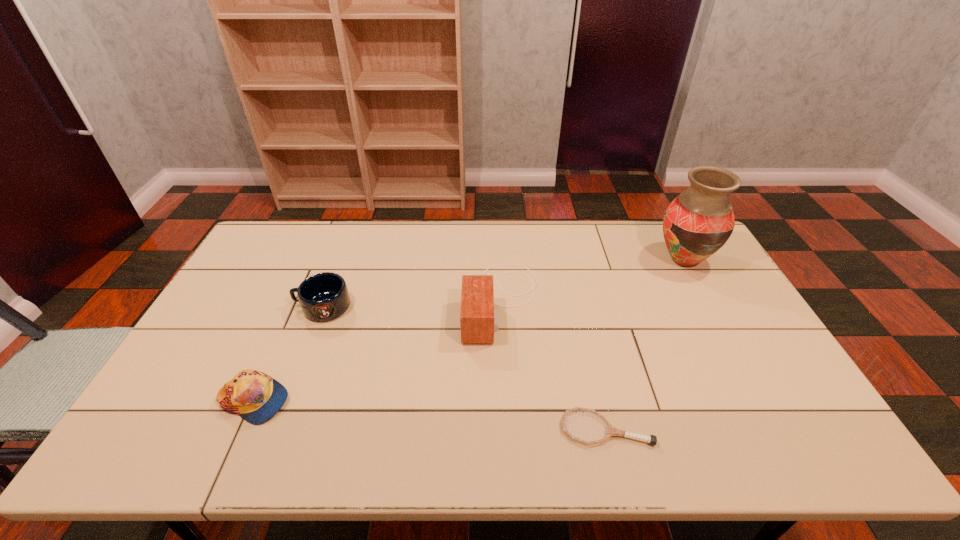
Identify the location of unoccupied area between the third object from right to left and the cap. The height and width of the screenshot is (540, 960). (377, 351).

Image resolution: width=960 pixels, height=540 pixels. What are the coordinates of `empty space that is in between the tallest object and the second tallest object` in the screenshot? It's located at [x=592, y=281].

Where is `free spot between the cap and the mug`? Image resolution: width=960 pixels, height=540 pixels. free spot between the cap and the mug is located at coordinates (288, 354).

Find the location of a particular element. empty location between the cap and the third object from left to right is located at coordinates (377, 351).

This screenshot has height=540, width=960. What are the coordinates of `vacant space that's between the vase and the tennis racket` in the screenshot? It's located at (645, 344).

This screenshot has width=960, height=540. In order to click on free space that is in between the radio receiver and the mug in this screenshot , I will do `click(412, 304)`.

I want to click on blank region between the mug and the shortest object, so click(465, 368).

Find the location of a particular element. free space between the cap and the mug is located at coordinates (288, 354).

At what (x,y) coordinates should I click in order to perform the action: click on the closest object to the cap. Please return your answer as a coordinate pair (x, y). Looking at the image, I should click on (324, 296).

Select which object appears as the fourth closest to the tallest object. Please provide its 2D coordinates. Your answer should be formatted as a tuple, i.e. [(x, y)], where the tuple contains the x and y coordinates of a point satisfying the conditions above.

[(256, 397)]